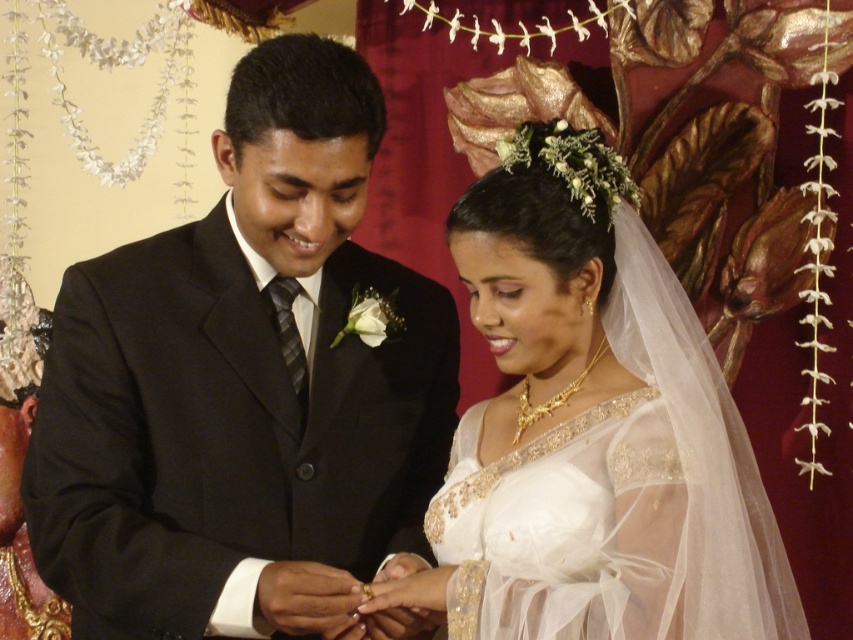
Which is more to the left, black satin suit at center or gold shiny ring at center?

black satin suit at center

Locate an element on the screen. black satin suit at center is located at coordinates (242, 387).

Between point (408, 432) and point (367, 596), which one is positioned in front?

Point (367, 596) is more forward.

Locate an element on the screen. black satin suit at center is located at coordinates pos(242,387).

Can you confirm if white sheer fabric dress at center is taller than gold shiny ring at center?

Yes, white sheer fabric dress at center is taller than gold shiny ring at center.

Is white sheer fabric dress at center smaller than gold shiny ring at center?

No, white sheer fabric dress at center is not smaller than gold shiny ring at center.

Find the location of `white sheer fabric dress at center`. white sheer fabric dress at center is located at coordinates (566, 529).

In order to click on white sheer fabric dress at center in this screenshot , I will do `click(566, 529)`.

Does black satin suit at center have a lesser width compared to white sheer dress at center?

Yes, black satin suit at center is thinner than white sheer dress at center.

Which of these two, black satin suit at center or white sheer dress at center, stands shorter?

white sheer dress at center is shorter.

Which is in front, point (308, 502) or point (645, 621)?

Positioned in front is point (645, 621).

Image resolution: width=853 pixels, height=640 pixels. What are the coordinates of `black satin suit at center` in the screenshot? It's located at 242,387.